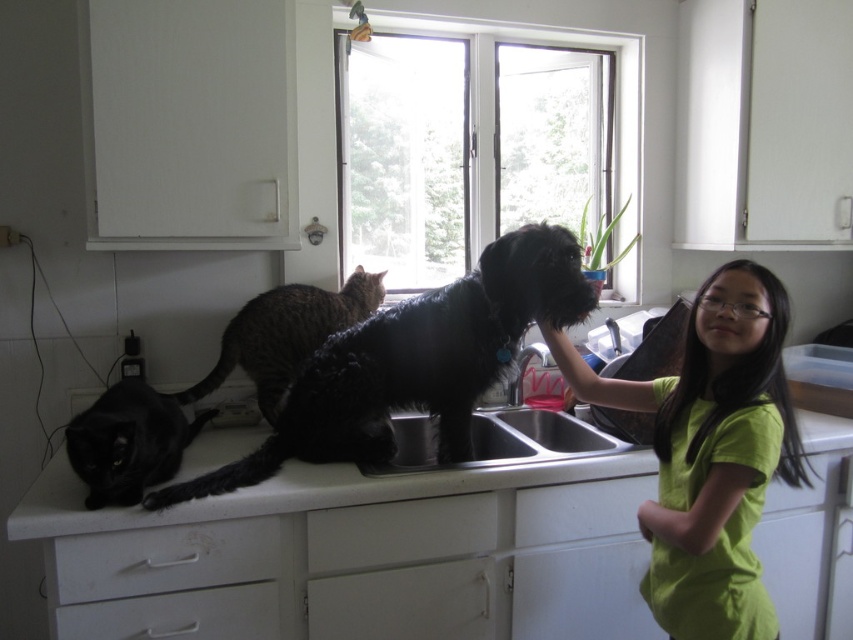
Question: Is dark brown fur cat at center to the left of white matte drawer at lower center from the viewer's perspective?

Choices:
 (A) yes
 (B) no

Answer: (A)

Question: Which object is farther from the camera taking this photo?

Choices:
 (A) white matte drawer at center
 (B) dark brown fur cat at center
 (C) white matte counter top at center

Answer: (A)

Question: Is white matte counter top at center behind white matte drawer at lower left?

Choices:
 (A) no
 (B) yes

Answer: (A)

Question: Can you confirm if white matte counter top at center is wider than white matte drawer at lower center?

Choices:
 (A) no
 (B) yes

Answer: (B)

Question: Which point is farther to the camera?

Choices:
 (A) stainless steel sink at center
 (B) white matte drawer at center
 (C) white matte drawer at lower center

Answer: (C)

Question: Which of the following is the farthest from the observer?

Choices:
 (A) (91, 589)
 (B) (381, 524)
 (C) (120, 465)
 (D) (310, 515)

Answer: (B)